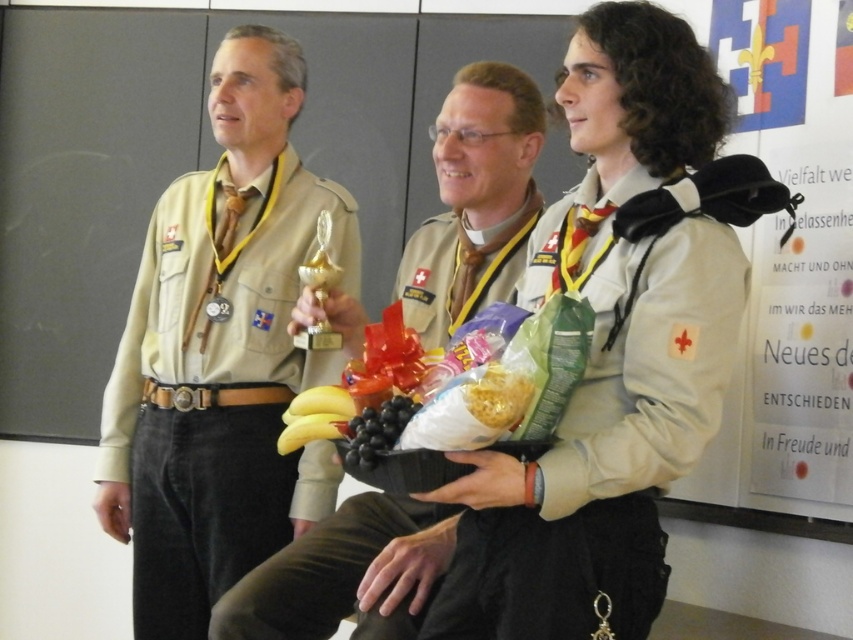
Consider the image. Measure the distance between shiny golden snack at center and gold shiny trophy at center.

The distance of shiny golden snack at center from gold shiny trophy at center is 60.59 centimeters.

Can you confirm if shiny golden snack at center is bigger than gold shiny trophy at center?

Incorrect, shiny golden snack at center is not larger than gold shiny trophy at center.

Is point (509, 426) farther from camera compared to point (315, 262)?

No.

You are a GUI agent. You are given a task and a screenshot of the screen. Output one action in this format:
    pyautogui.click(x=<x>, y=<y>)
    Task: Click on the shiny golden snack at center
    
    Given the screenshot: What is the action you would take?
    pyautogui.click(x=498, y=396)

Which is above, matte khaki shirt at left or beige fabric uniform at center?

matte khaki shirt at left is above.

Can you confirm if matte khaki shirt at left is thinner than beige fabric uniform at center?

No.

Describe the element at coordinates (219, 353) in the screenshot. I see `matte khaki shirt at left` at that location.

In order to click on matte khaki shirt at left in this screenshot , I will do `click(219, 353)`.

Between point (376, 424) and point (323, 212), which one is positioned behind?

Positioned behind is point (323, 212).

Who is higher up, black matte grapes at center or gold shiny trophy at center?

Positioned higher is gold shiny trophy at center.

Between point (352, 428) and point (312, 284), which one is positioned behind?

Point (312, 284)

I want to click on black matte grapes at center, so click(376, 429).